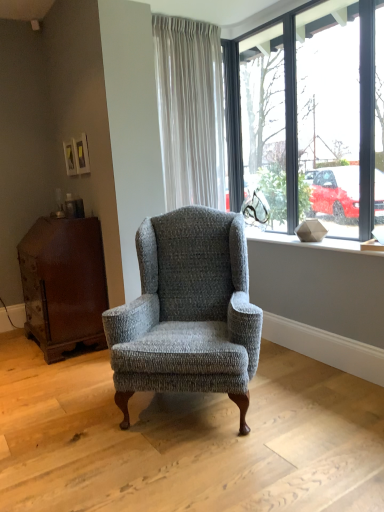
Question: Considering the positions of matte gray stone at upper right and textured gray wingback chair at center in the image, is matte gray stone at upper right taller or shorter than textured gray wingback chair at center?

Choices:
 (A) tall
 (B) short

Answer: (B)

Question: Is matte gray stone at upper right to the left or to the right of textured gray wingback chair at center in the image?

Choices:
 (A) right
 (B) left

Answer: (A)

Question: Which of these objects is positioned farthest from the dark brown wood dresser at left?

Choices:
 (A) clear glass window at upper right
 (B) matte gray stone at upper right
 (C) white textured curtain at upper center
 (D) textured gray wingback chair at center

Answer: (A)

Question: Estimate the real-world distances between objects in this image. Which object is closer to the matte gray stone at upper right?

Choices:
 (A) white textured curtain at upper center
 (B) dark brown wood dresser at left
 (C) textured gray wingback chair at center
 (D) clear glass window at upper right

Answer: (D)